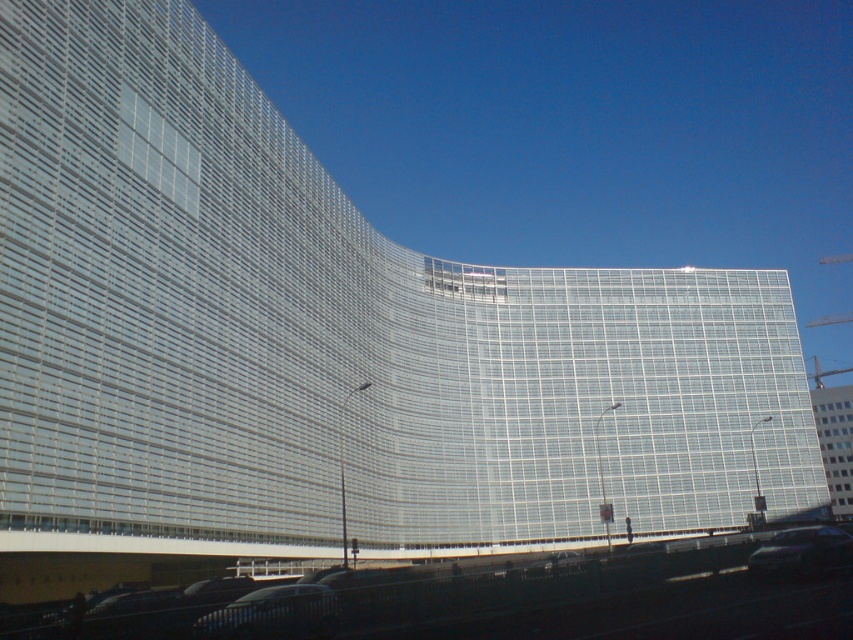
Can you confirm if shiny black car at lower center is wider than metallic silver car at center?

Incorrect, shiny black car at lower center's width does not surpass metallic silver car at center's.

Does shiny black car at lower center appear over metallic silver car at center?

Correct, shiny black car at lower center is located above metallic silver car at center.

The image size is (853, 640). I want to click on shiny black car at lower center, so click(273, 614).

Can you confirm if black asphalt train track at lower center is wider than metallic silver car at center?

Yes, black asphalt train track at lower center is wider than metallic silver car at center.

Which is behind, point (848, 600) or point (575, 557)?

Positioned behind is point (575, 557).

You are a GUI agent. You are given a task and a screenshot of the screen. Output one action in this format:
    pyautogui.click(x=<x>, y=<y>)
    Task: Click on the black asphalt train track at lower center
    This screenshot has width=853, height=640.
    Given the screenshot: What is the action you would take?
    pyautogui.click(x=494, y=598)

Is shiny black car at lower right closer to the viewer compared to metallic silver car at center?

No.

Between shiny black car at lower right and metallic silver car at center, which one appears on the left side from the viewer's perspective?

Positioned to the left is metallic silver car at center.

The height and width of the screenshot is (640, 853). In order to click on shiny black car at lower right in this screenshot , I will do `click(801, 552)`.